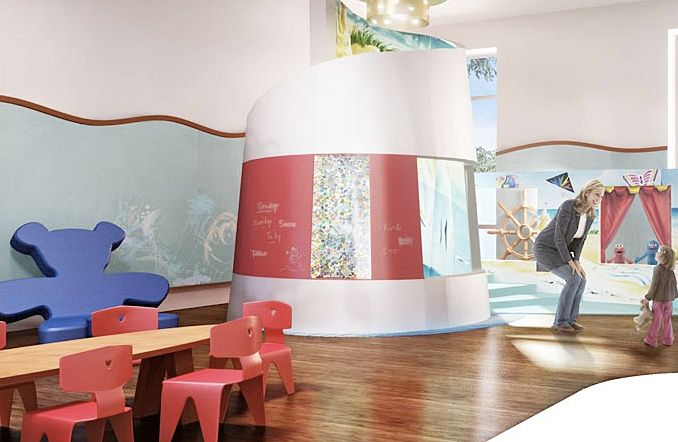
This screenshot has height=442, width=678. Find the location of `teddy bear`. teddy bear is located at coordinates (641, 314).